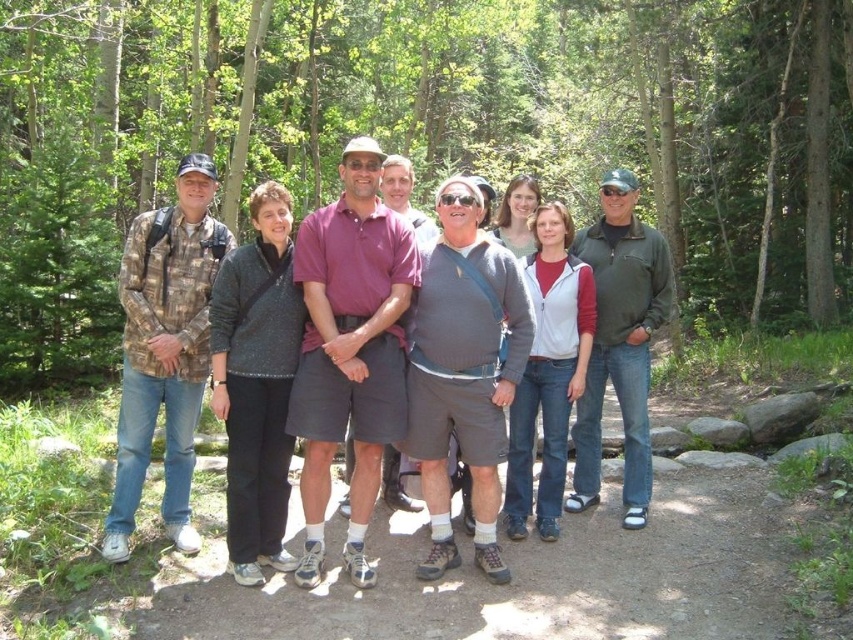
You are a photographer trying to capture a photo of the camouflage fabric shirt at left while ensuring the green leafy trees at center are visible in the background. Can you tell me if the trees are above or below the shirt in the image?

The green leafy trees at center is positioned over camouflage fabric shirt at left, so the trees are above the shirt in the image.

You are part of a hiking group standing in a forested area with green leafy trees at center. If you want to move towards the trees, which direction should you face?

The green leafy trees at center are located at point [426,136], so you should face towards the center of the image to move towards them.